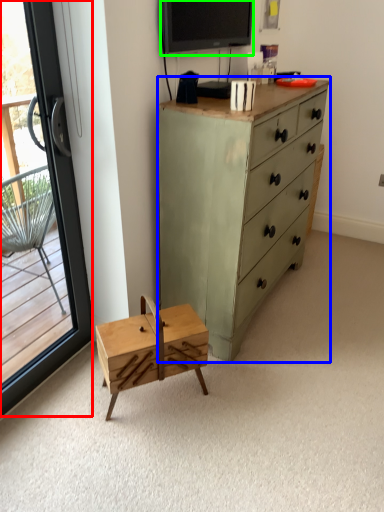
Question: Based on their relative distances, which object is nearer to window (highlighted by a red box)? Choose from chest of drawers (highlighted by a blue box) and television (highlighted by a green box).

Choices:
 (A) chest of drawers
 (B) television

Answer: (A)